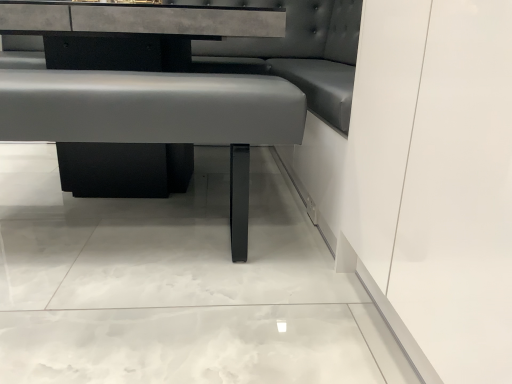
Question: Considering the positions of satin black table at center and matte gray cushion at center in the image, is satin black table at center taller or shorter than matte gray cushion at center?

Choices:
 (A) short
 (B) tall

Answer: (B)

Question: Considering the positions of point (142, 67) and point (212, 125), is point (142, 67) closer or farther from the camera than point (212, 125)?

Choices:
 (A) closer
 (B) farther

Answer: (B)

Question: Based on their positions, is satin black table at center located to the left or right of matte gray cushion at center?

Choices:
 (A) right
 (B) left

Answer: (B)

Question: Is matte gray cushion at center in front of or behind satin black table at center in the image?

Choices:
 (A) front
 (B) behind

Answer: (A)

Question: Is matte gray cushion at center bigger or smaller than satin black table at center?

Choices:
 (A) small
 (B) big

Answer: (A)

Question: Is matte gray cushion at center inside the boundaries of satin black table at center, or outside?

Choices:
 (A) outside
 (B) inside

Answer: (B)

Question: Is matte gray cushion at center taller or shorter than satin black table at center?

Choices:
 (A) tall
 (B) short

Answer: (B)